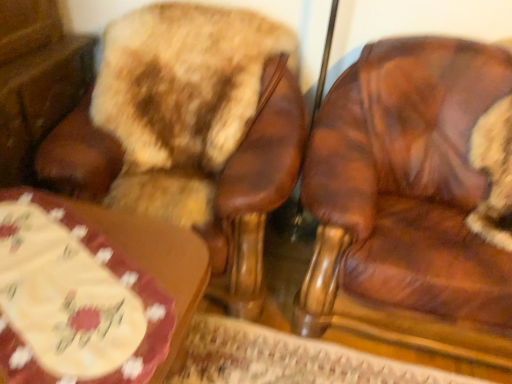
Question: Considering the relative positions of wooden table at lower left and brown leather chair at right, marked as the 2th chair in a left-to-right arrangement, in the image provided, is wooden table at lower left to the right of brown leather chair at right, marked as the 2th chair in a left-to-right arrangement, from the viewer's perspective?

Choices:
 (A) yes
 (B) no

Answer: (B)

Question: Is wooden table at lower left not inside brown leather chair at right, marked as the 2th chair in a left-to-right arrangement?

Choices:
 (A) yes
 (B) no

Answer: (A)

Question: From the image's perspective, is wooden table at lower left under brown leather chair at right, which appears as the 1th chair when viewed from the right?

Choices:
 (A) no
 (B) yes

Answer: (B)

Question: Considering the relative positions of wooden table at lower left and brown leather chair at right, marked as the 2th chair in a left-to-right arrangement, in the image provided, is wooden table at lower left to the left of brown leather chair at right, marked as the 2th chair in a left-to-right arrangement, from the viewer's perspective?

Choices:
 (A) no
 (B) yes

Answer: (B)

Question: Does wooden table at lower left have a greater width compared to brown leather chair at right, which appears as the 1th chair when viewed from the right?

Choices:
 (A) no
 (B) yes

Answer: (A)

Question: From their relative heights in the image, would you say brown leather chair at right, which appears as the 1th chair when viewed from the right, is taller or shorter than brown leather chair at upper left, the second chair viewed from the right?

Choices:
 (A) tall
 (B) short

Answer: (A)

Question: In terms of width, does brown leather chair at right, which appears as the 1th chair when viewed from the right, look wider or thinner when compared to brown leather chair at upper left, the second chair viewed from the right?

Choices:
 (A) thin
 (B) wide

Answer: (A)

Question: Is brown leather chair at right, which appears as the 1th chair when viewed from the right, bigger or smaller than brown leather chair at upper left, the second chair viewed from the right?

Choices:
 (A) small
 (B) big

Answer: (B)

Question: From a real-world perspective, is brown leather chair at right, marked as the 2th chair in a left-to-right arrangement, positioned above or below brown leather chair at upper left, the second chair viewed from the right?

Choices:
 (A) above
 (B) below

Answer: (A)

Question: Considering the positions of wooden table at lower left and brown leather chair at upper left, placed as the first chair when sorted from left to right, in the image, is wooden table at lower left bigger or smaller than brown leather chair at upper left, placed as the first chair when sorted from left to right,?

Choices:
 (A) small
 (B) big

Answer: (A)

Question: Visually, is wooden table at lower left positioned to the left or to the right of brown leather chair at upper left, placed as the first chair when sorted from left to right?

Choices:
 (A) left
 (B) right

Answer: (A)

Question: Is wooden table at lower left taller or shorter than brown leather chair at upper left, placed as the first chair when sorted from left to right?

Choices:
 (A) tall
 (B) short

Answer: (B)

Question: From the image's perspective, relative to brown leather chair at upper left, the second chair viewed from the right, is wooden table at lower left above or below?

Choices:
 (A) below
 (B) above

Answer: (A)

Question: In the image, is wooden table at lower left positioned in front of or behind brown leather chair at right, which appears as the 1th chair when viewed from the right?

Choices:
 (A) behind
 (B) front

Answer: (B)

Question: From a real-world perspective, is wooden table at lower left above or below brown leather chair at right, marked as the 2th chair in a left-to-right arrangement?

Choices:
 (A) below
 (B) above

Answer: (A)